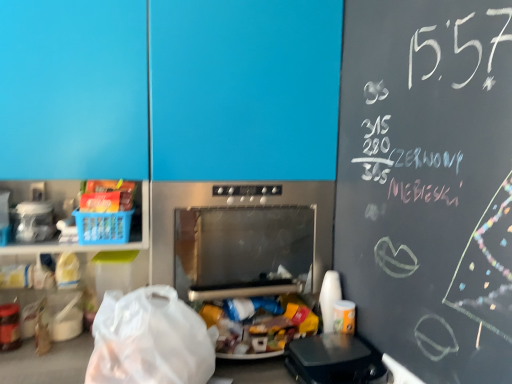
Locate an element on the screen. black plastic waffle maker at lower right, which is the first appliance in bottom-to-top order is located at coordinates (334, 360).

Measure the distance between point (x=246, y=185) and camera.

Point (x=246, y=185) is 4.40 feet away from camera.

The height and width of the screenshot is (384, 512). What are the coordinates of `metallic oven at center` in the screenshot? It's located at (245, 89).

Describe the element at coordinates (34, 221) in the screenshot. I see `clear plastic container at left, acting as the 1th appliance starting from the left` at that location.

Where is `transparent plastic grocery bag at lower left`? transparent plastic grocery bag at lower left is located at coordinates (149, 340).

Locate an element on the screen. Image resolution: width=512 pixels, height=384 pixels. black plastic waffle maker at lower right, which is the first appliance in bottom-to-top order is located at coordinates (334, 360).

Who is bigger, clear plastic container at left, acting as the 1th appliance starting from the left, or black plastic waffle maker at lower right, which is the first appliance in bottom-to-top order?

Bigger between the two is black plastic waffle maker at lower right, which is the first appliance in bottom-to-top order.

Does clear plastic container at left, the 3th appliance in the right-to-left sequence, have a greater height compared to black plastic waffle maker at lower right, which is the first appliance in bottom-to-top order?

Indeed, clear plastic container at left, the 3th appliance in the right-to-left sequence, has a greater height compared to black plastic waffle maker at lower right, which is the first appliance in bottom-to-top order.

Is clear plastic container at left, acting as the 1th appliance starting from the left, to the left or to the right of black plastic waffle maker at lower right, which is the first appliance in bottom-to-top order, in the image?

clear plastic container at left, acting as the 1th appliance starting from the left, is positioned on black plastic waffle maker at lower right, which is the first appliance in bottom-to-top order,'s left side.

Would you say clear plastic container at left, the 3th appliance when ordered from bottom to top, is outside black plastic waffle maker at lower right, the first appliance in the right-to-left sequence?

That's correct, clear plastic container at left, the 3th appliance when ordered from bottom to top, is outside of black plastic waffle maker at lower right, the first appliance in the right-to-left sequence.

From a real-world perspective, which object rests below the other?

black plastic waffle maker at lower right, the first appliance in the right-to-left sequence, from a real-world perspective.

Considering the sizes of black plastic waffle maker at lower right, which is the first appliance in bottom-to-top order, and transparent plastic grocery bag at lower left in the image, is black plastic waffle maker at lower right, which is the first appliance in bottom-to-top order, taller or shorter than transparent plastic grocery bag at lower left?

In the image, black plastic waffle maker at lower right, which is the first appliance in bottom-to-top order, appears to be shorter than transparent plastic grocery bag at lower left.

Based on the photo, does black plastic waffle maker at lower right, placed as the third appliance when sorted from left to right, touch transparent plastic grocery bag at lower left?

No, black plastic waffle maker at lower right, placed as the third appliance when sorted from left to right, is not with transparent plastic grocery bag at lower left.

Considering the points (298, 339) and (93, 367), which point is in front, point (298, 339) or point (93, 367)?

The point (93, 367) is more forward.

Who is shorter, black plastic waffle maker at lower right, arranged as the 3th appliance when viewed from the top, or clear plastic container at left, acting as the 1th appliance starting from the left?

With less height is black plastic waffle maker at lower right, arranged as the 3th appliance when viewed from the top.

From a real-world perspective, which is physically below, black plastic waffle maker at lower right, placed as the third appliance when sorted from left to right, or clear plastic container at left, the 3th appliance when ordered from bottom to top?

In real-world perspective, black plastic waffle maker at lower right, placed as the third appliance when sorted from left to right, is lower.

In the scene shown: Is black plastic waffle maker at lower right, arranged as the 3th appliance when viewed from the top, positioned beyond the bounds of clear plastic container at left, placed as the first appliance when sorted from top to bottom?

Yes, black plastic waffle maker at lower right, arranged as the 3th appliance when viewed from the top, is outside of clear plastic container at left, placed as the first appliance when sorted from top to bottom.

From the image's perspective, which object appears higher, black plastic waffle maker at lower right, arranged as the 3th appliance when viewed from the top, or clear plastic container at left, acting as the 1th appliance starting from the left?

clear plastic container at left, acting as the 1th appliance starting from the left.

Can you tell me how much transparent plastic grocery bag at lower left and metallic oven at center differ in facing direction?

There is a 0.785-degree angle between the facing directions of transparent plastic grocery bag at lower left and metallic oven at center.

Is transparent plastic grocery bag at lower left aimed at metallic oven at center?

No, transparent plastic grocery bag at lower left does not turn towards metallic oven at center.

Is transparent plastic grocery bag at lower left next to metallic oven at center?

No, transparent plastic grocery bag at lower left is not in contact with metallic oven at center.

Considering the sizes of transparent plastic grocery bag at lower left and metallic oven at center in the image, is transparent plastic grocery bag at lower left taller or shorter than metallic oven at center?

Considering their sizes, transparent plastic grocery bag at lower left has less height than metallic oven at center.

Which of these two, metallic oven at center or clear plastic container at left, the 3th appliance in the right-to-left sequence, is bigger?

Bigger between the two is metallic oven at center.

Is metallic oven at center situated inside clear plastic container at left, the 3th appliance in the right-to-left sequence, or outside?

metallic oven at center lies outside clear plastic container at left, the 3th appliance in the right-to-left sequence.

Is point (242, 13) positioned in front of point (39, 213)?

No, it is behind (39, 213).

Is metallic oven at center next to stainless steel microwave at center, arranged as the 2th appliance when viewed from the right?

No.

Considering the positions of objects metallic oven at center and stainless steel microwave at center, positioned as the 2th appliance in top-to-bottom order, in the image provided, who is behind, metallic oven at center or stainless steel microwave at center, positioned as the 2th appliance in top-to-bottom order,?

stainless steel microwave at center, positioned as the 2th appliance in top-to-bottom order.

Considering the sizes of objects metallic oven at center and stainless steel microwave at center, which appears as the 2th appliance when viewed from the left, in the image provided, who is bigger, metallic oven at center or stainless steel microwave at center, which appears as the 2th appliance when viewed from the left,?

Bigger between the two is metallic oven at center.

Would you say stainless steel microwave at center, arranged as the 2th appliance when viewed from the right, is part of metallic oven at center's contents?

Yes, metallic oven at center contains stainless steel microwave at center, arranged as the 2th appliance when viewed from the right.

Is stainless steel microwave at center, positioned as the 2th appliance in top-to-bottom order, next to clear plastic container at left, acting as the 1th appliance starting from the left, and touching it?

No, stainless steel microwave at center, positioned as the 2th appliance in top-to-bottom order, is not next to clear plastic container at left, acting as the 1th appliance starting from the left.

From a real-world perspective, is stainless steel microwave at center, positioned as the second appliance in bottom-to-top order, under clear plastic container at left, acting as the 1th appliance starting from the left?

Indeed, from a real-world perspective, stainless steel microwave at center, positioned as the second appliance in bottom-to-top order, is positioned beneath clear plastic container at left, acting as the 1th appliance starting from the left.

Is stainless steel microwave at center, positioned as the 2th appliance in top-to-bottom order, in front of or behind clear plastic container at left, placed as the first appliance when sorted from top to bottom, in the image?

In the image, stainless steel microwave at center, positioned as the 2th appliance in top-to-bottom order, appears behind clear plastic container at left, placed as the first appliance when sorted from top to bottom.

In terms of width, does stainless steel microwave at center, arranged as the 2th appliance when viewed from the right, look wider or thinner when compared to clear plastic container at left, placed as the first appliance when sorted from top to bottom?

Considering their sizes, stainless steel microwave at center, arranged as the 2th appliance when viewed from the right, looks broader than clear plastic container at left, placed as the first appliance when sorted from top to bottom.

You are a GUI agent. You are given a task and a screenshot of the screen. Output one action in this format:
    pyautogui.click(x=<x>, y=<y>)
    Task: Click on the appliance in front of the clear plastic container at left, acting as the 1th appliance starting from the left
    The height and width of the screenshot is (384, 512).
    Given the screenshot: What is the action you would take?
    pyautogui.click(x=334, y=360)

The width and height of the screenshot is (512, 384). Identify the location of grocery bag above the black plastic waffle maker at lower right, which is the first appliance in bottom-to-top order (from the image's perspective). (149, 340).

Based on their spatial positions, is clear plastic container at left, acting as the 1th appliance starting from the left, or stainless steel microwave at center, positioned as the second appliance in bottom-to-top order, further from metallic oven at center?

clear plastic container at left, acting as the 1th appliance starting from the left, is positioned further to the anchor metallic oven at center.

Estimate the real-world distances between objects in this image. Which object is closer to metallic oven at center, transparent plastic grocery bag at lower left or black plastic waffle maker at lower right, which is the first appliance in bottom-to-top order?

transparent plastic grocery bag at lower left.

Estimate the real-world distances between objects in this image. Which object is further from transparent plastic grocery bag at lower left, black plastic waffle maker at lower right, placed as the third appliance when sorted from left to right, or metallic oven at center?

metallic oven at center lies further to transparent plastic grocery bag at lower left than the other object.

In the scene shown: Based on their spatial positions, is clear plastic container at left, placed as the first appliance when sorted from top to bottom, or transparent plastic grocery bag at lower left further from black plastic waffle maker at lower right, the first appliance in the right-to-left sequence?

Based on the image, clear plastic container at left, placed as the first appliance when sorted from top to bottom, appears to be further to black plastic waffle maker at lower right, the first appliance in the right-to-left sequence.

Considering their positions, is transparent plastic grocery bag at lower left positioned closer to metallic oven at center than stainless steel microwave at center, positioned as the 2th appliance in top-to-bottom order?

stainless steel microwave at center, positioned as the 2th appliance in top-to-bottom order, lies closer to metallic oven at center than the other object.

When comparing their distances from transparent plastic grocery bag at lower left, does stainless steel microwave at center, positioned as the second appliance in bottom-to-top order, or metallic oven at center seem closer?

stainless steel microwave at center, positioned as the second appliance in bottom-to-top order, is closer to transparent plastic grocery bag at lower left.

Looking at the image, which one is located further to stainless steel microwave at center, positioned as the 2th appliance in top-to-bottom order, metallic oven at center or transparent plastic grocery bag at lower left?

transparent plastic grocery bag at lower left is positioned further to the anchor stainless steel microwave at center, positioned as the 2th appliance in top-to-bottom order.

Estimate the real-world distances between objects in this image. Which object is further from clear plastic container at left, the 3th appliance in the right-to-left sequence, metallic oven at center or stainless steel microwave at center, positioned as the 2th appliance in top-to-bottom order?

The object further to clear plastic container at left, the 3th appliance in the right-to-left sequence, is stainless steel microwave at center, positioned as the 2th appliance in top-to-bottom order.

Where is `grocery bag situated between clear plastic container at left, the 3th appliance in the right-to-left sequence, and stainless steel microwave at center, positioned as the second appliance in bottom-to-top order, from left to right`? grocery bag situated between clear plastic container at left, the 3th appliance in the right-to-left sequence, and stainless steel microwave at center, positioned as the second appliance in bottom-to-top order, from left to right is located at coordinates (149, 340).

The width and height of the screenshot is (512, 384). I want to click on appliance between clear plastic container at left, the 3th appliance in the right-to-left sequence, and black plastic waffle maker at lower right, the first appliance in the right-to-left sequence, so click(x=241, y=237).

Identify the location of grocery bag located between clear plastic container at left, the 3th appliance when ordered from bottom to top, and black plastic waffle maker at lower right, placed as the third appliance when sorted from left to right, in the left-right direction. The image size is (512, 384). (149, 340).

I want to click on grocery bag between metallic oven at center and black plastic waffle maker at lower right, the first appliance in the right-to-left sequence, from top to bottom, so click(149, 340).